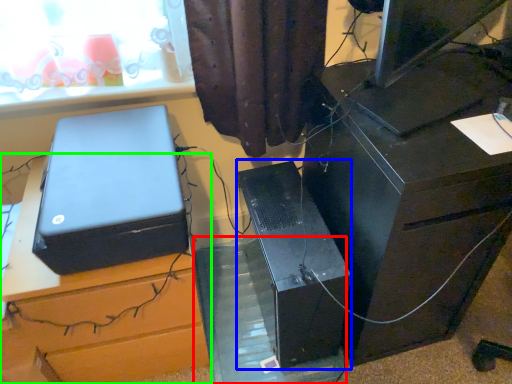
Question: Which object is the closest to the glass table (highlighted by a red box)? Choose among these: computer tower (highlighted by a blue box) or furniture (highlighted by a green box).

Choices:
 (A) computer tower
 (B) furniture

Answer: (A)